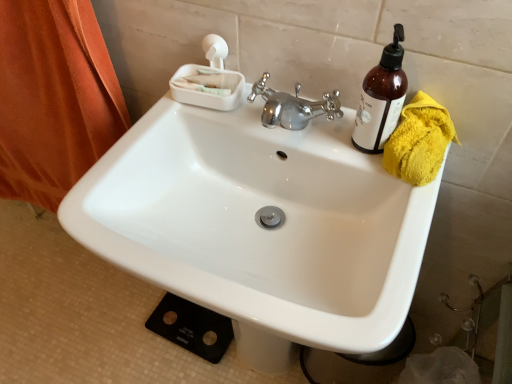
Question: Is white plastic soap dish at upper center in front of or behind translucent amber bottle at upper right in the image?

Choices:
 (A) behind
 (B) front

Answer: (A)

Question: In the image, is white plastic soap dish at upper center on the left side or the right side of translucent amber bottle at upper right?

Choices:
 (A) left
 (B) right

Answer: (A)

Question: Which of these objects is positioned closest to the white plastic soap dish at upper center?

Choices:
 (A) orange fabric at left
 (B) white glossy sink at center
 (C) yellow fluffy towel at right
 (D) translucent amber bottle at upper right

Answer: (B)

Question: Which object is positioned closest to the white glossy sink at center?

Choices:
 (A) white plastic soap dish at upper center
 (B) orange fabric at left
 (C) yellow fluffy towel at right
 (D) translucent amber bottle at upper right

Answer: (A)